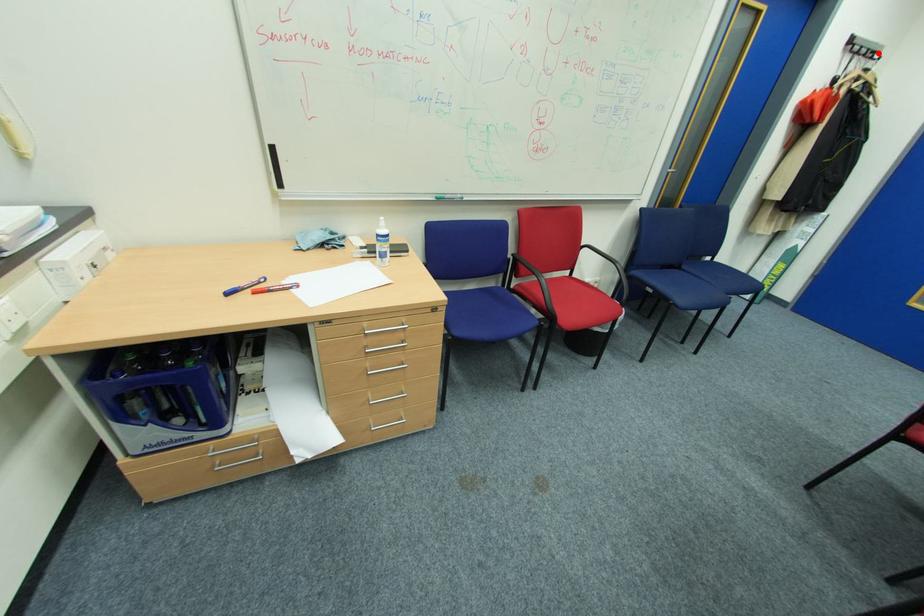
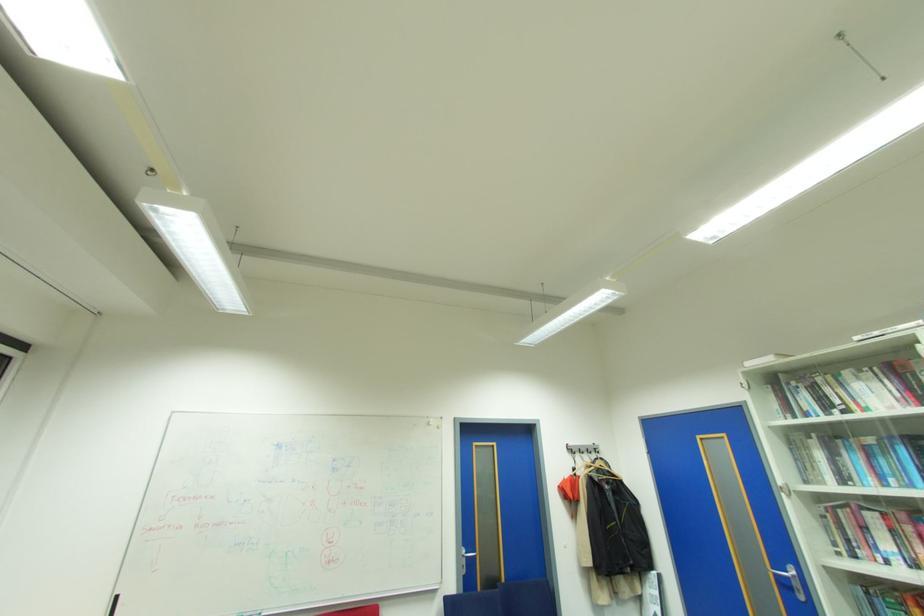
The point at the highlighted location is marked in the first image. Where is the corresponding point in the second image?

(600, 448)